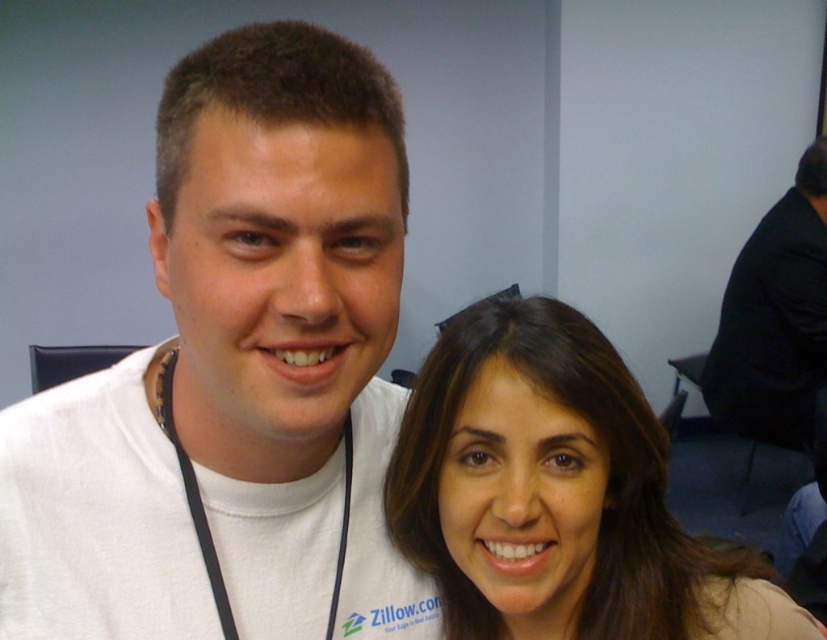
Which is in front, point (615, 451) or point (722, 358)?

Point (615, 451) is more forward.

What do you see at coordinates (555, 493) in the screenshot?
I see `brown hair at center` at bounding box center [555, 493].

Locate an element on the screen. The width and height of the screenshot is (827, 640). brown hair at center is located at coordinates (555, 493).